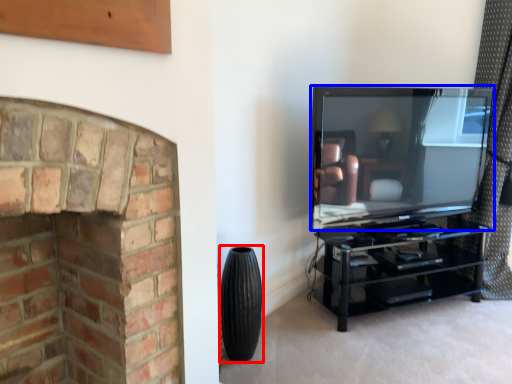
Question: Which object appears farthest to the camera in this image, tire (highlighted by a red box) or television (highlighted by a blue box)?

Choices:
 (A) tire
 (B) television

Answer: (B)